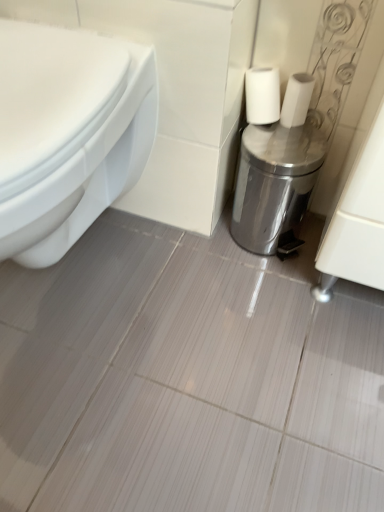
Question: Is white matte toilet paper at center positioned far away from white glossy toilet at left?

Choices:
 (A) no
 (B) yes

Answer: (A)

Question: Does white matte toilet paper at center come in front of white glossy toilet at left?

Choices:
 (A) yes
 (B) no

Answer: (B)

Question: Considering the relative sizes of white matte toilet paper at center and white glossy toilet at left in the image provided, is white matte toilet paper at center smaller than white glossy toilet at left?

Choices:
 (A) yes
 (B) no

Answer: (A)

Question: Considering the relative sizes of white matte toilet paper at center and white glossy toilet at left in the image provided, is white matte toilet paper at center bigger than white glossy toilet at left?

Choices:
 (A) yes
 (B) no

Answer: (B)

Question: Does white matte toilet paper at center have a greater width compared to white glossy toilet at left?

Choices:
 (A) no
 (B) yes

Answer: (A)

Question: Is white glossy toilet at left inside or outside of silver metallic trash can at right?

Choices:
 (A) inside
 (B) outside

Answer: (B)

Question: In terms of width, does white glossy toilet at left look wider or thinner when compared to silver metallic trash can at right?

Choices:
 (A) thin
 (B) wide

Answer: (B)

Question: In terms of size, does white glossy toilet at left appear bigger or smaller than silver metallic trash can at right?

Choices:
 (A) small
 (B) big

Answer: (B)

Question: In the image, is white glossy toilet at left on the left side or the right side of silver metallic trash can at right?

Choices:
 (A) right
 (B) left

Answer: (B)

Question: Considering their positions, is white matte toilet paper at center located in front of or behind white glossy toilet at left?

Choices:
 (A) behind
 (B) front

Answer: (A)

Question: Is point (286, 123) positioned closer to the camera than point (18, 159)?

Choices:
 (A) closer
 (B) farther

Answer: (B)

Question: From their relative heights in the image, would you say white matte toilet paper at center is taller or shorter than white glossy toilet at left?

Choices:
 (A) short
 (B) tall

Answer: (A)

Question: In terms of width, does white matte toilet paper at center look wider or thinner when compared to white glossy toilet at left?

Choices:
 (A) thin
 (B) wide

Answer: (A)

Question: In terms of size, does white glossy toilet at left appear bigger or smaller than white matte toilet paper at center?

Choices:
 (A) big
 (B) small

Answer: (A)

Question: From the image's perspective, is white glossy toilet at left above or below white matte toilet paper at center?

Choices:
 (A) below
 (B) above

Answer: (A)